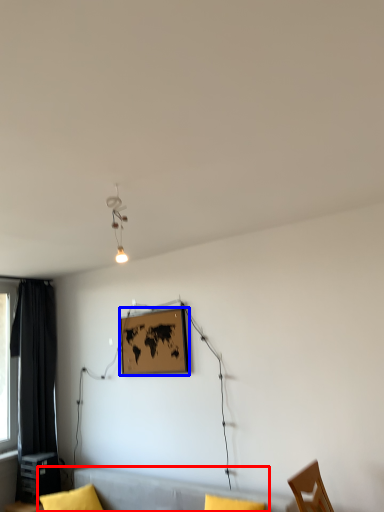
Question: Which object appears farthest to the camera in this image, couch (highlighted by a red box) or picture frame (highlighted by a blue box)?

Choices:
 (A) couch
 (B) picture frame

Answer: (B)